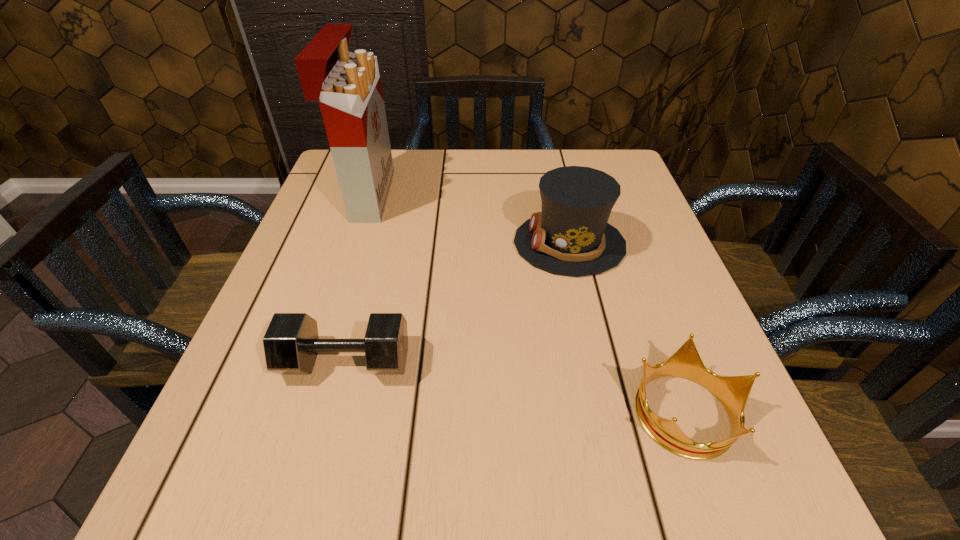
Locate an element on the screen. object present at the far edge is located at coordinates (348, 86).

I want to click on object that is at the near edge, so coord(732,391).

Where is `cigarette case situated at the left edge`? The width and height of the screenshot is (960, 540). cigarette case situated at the left edge is located at coordinates (348, 86).

In order to click on dumbbell that is at the left edge in this screenshot , I will do `click(291, 343)`.

Locate an element on the screen. The width and height of the screenshot is (960, 540). dress hat positioned at the right edge is located at coordinates (x=571, y=236).

I want to click on crown positioned at the right edge, so click(x=732, y=391).

The width and height of the screenshot is (960, 540). I want to click on object positioned at the far left corner, so click(348, 86).

The image size is (960, 540). I want to click on object at the near right corner, so click(732, 391).

The image size is (960, 540). I want to click on vacant area at the far edge, so click(x=480, y=158).

I want to click on vacant position at the near edge of the desktop, so click(x=370, y=499).